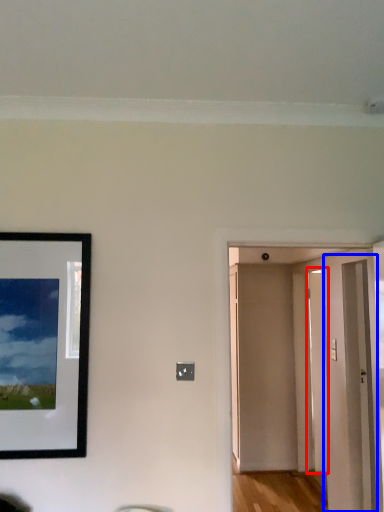
Question: Which of the following is the farthest to the observer, door (highlighted by a red box) or glass door (highlighted by a blue box)?

Choices:
 (A) door
 (B) glass door

Answer: (A)